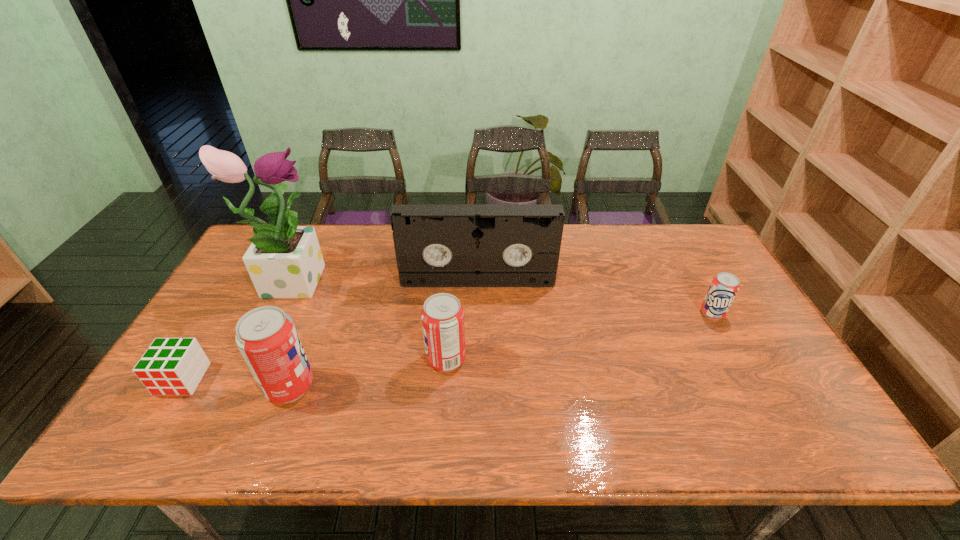
Locate an element on the screen. The height and width of the screenshot is (540, 960). vacant area that lies between the rightmost soda can and the flower arrangement is located at coordinates (502, 296).

Image resolution: width=960 pixels, height=540 pixels. I want to click on free space between the farthest soda can and the videotape, so click(595, 297).

You are a GUI agent. You are given a task and a screenshot of the screen. Output one action in this format:
    pyautogui.click(x=<x>, y=<y>)
    Task: Click on the unoccupied position between the rightmost object and the leftmost soda can
    Image resolution: width=960 pixels, height=540 pixels.
    Given the screenshot: What is the action you would take?
    pyautogui.click(x=501, y=350)

Identify which object is the fourth closest to the second soda can from left to right. Please provide its 2D coordinates. Your answer should be formatted as a tuple, i.e. [(x, y)], where the tuple contains the x and y coordinates of a point satisfying the conditions above.

[(170, 366)]

Identify which object is the fifth closest to the tallest object. Please provide its 2D coordinates. Your answer should be formatted as a tuple, i.e. [(x, y)], where the tuple contains the x and y coordinates of a point satisfying the conditions above.

[(724, 287)]

Identify the location of soda can object that ranks as the second closest to the cube. Image resolution: width=960 pixels, height=540 pixels. (442, 316).

Where is `soda can that is the second closest to the videotape`? Image resolution: width=960 pixels, height=540 pixels. soda can that is the second closest to the videotape is located at coordinates (267, 338).

Where is `vacant point that satisfies the following two spatial constraints: 1. on the back side of the second tallest soda can; 2. on the left side of the leftmost soda can`? vacant point that satisfies the following two spatial constraints: 1. on the back side of the second tallest soda can; 2. on the left side of the leftmost soda can is located at coordinates pos(300,360).

Identify the location of vacant space that satisfies the following two spatial constraints: 1. on the front-facing side of the tallest object; 2. on the red face of the shortest object. (244, 379).

Locate an element on the screen. This screenshot has width=960, height=540. blank space that satisfies the following two spatial constraints: 1. on the front-facing side of the rightmost object; 2. on the left side of the flower arrangement is located at coordinates (276, 313).